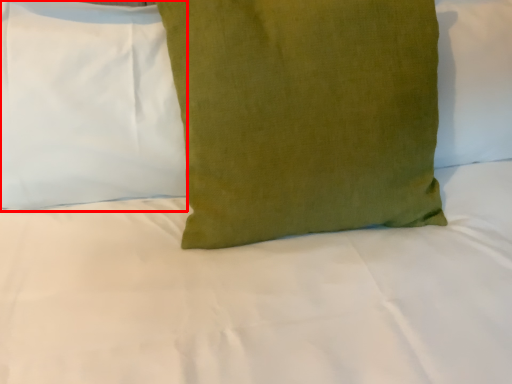
Question: From the image's perspective, where is pillow (annotated by the red box) located relative to pillow?

Choices:
 (A) above
 (B) below

Answer: (A)